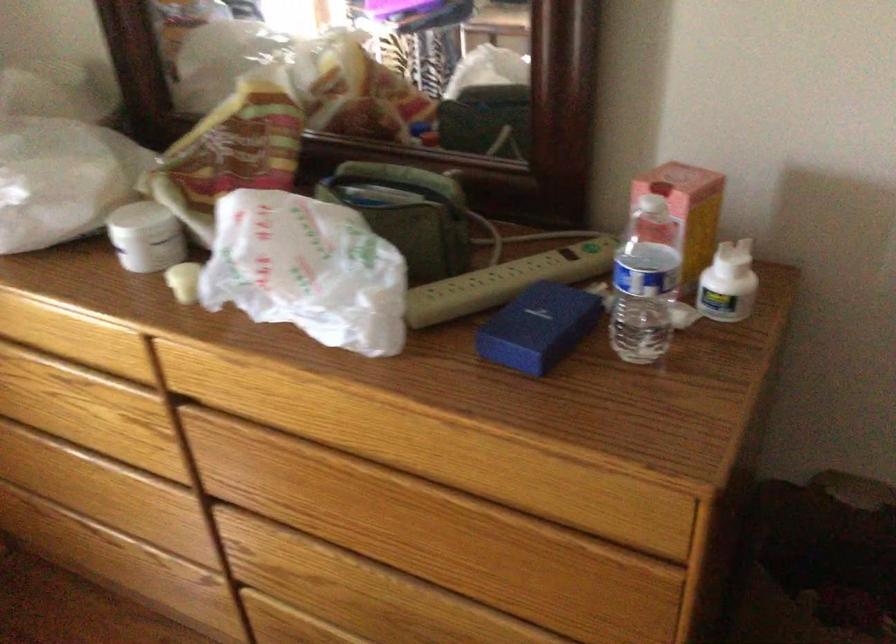
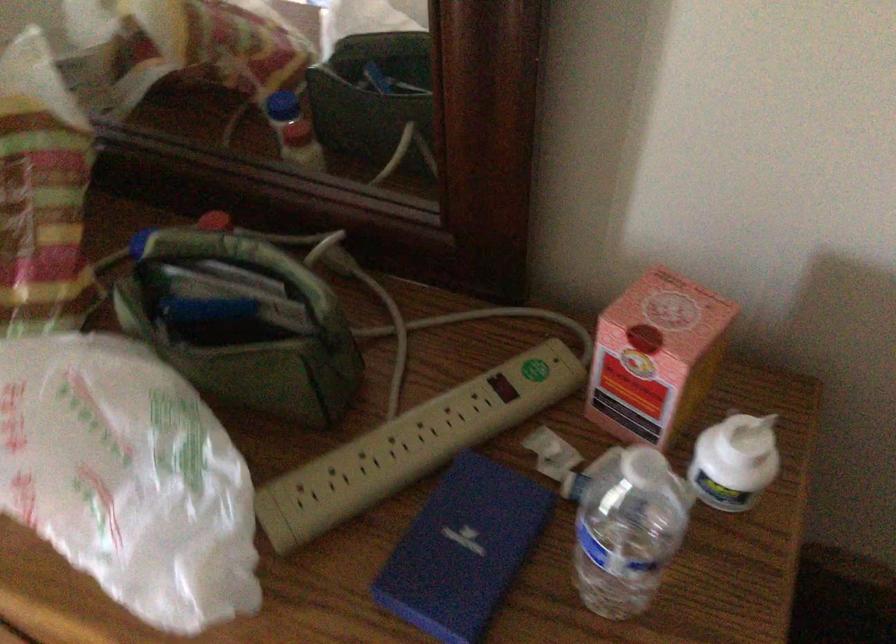
Question: How did the camera likely rotate?

Choices:
 (A) Left
 (B) Right
 (C) Up
 (D) Down

Answer: (D)